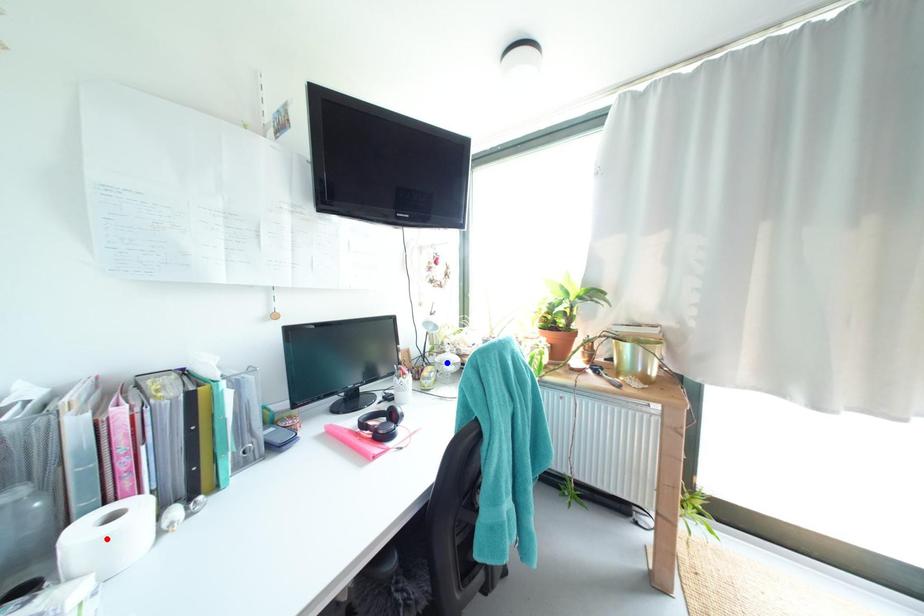
Question: In the image, two points are highlighted. Which point is nearer to the camera? Reply with the corresponding letter.

Choices:
 (A) blue point
 (B) red point

Answer: (B)